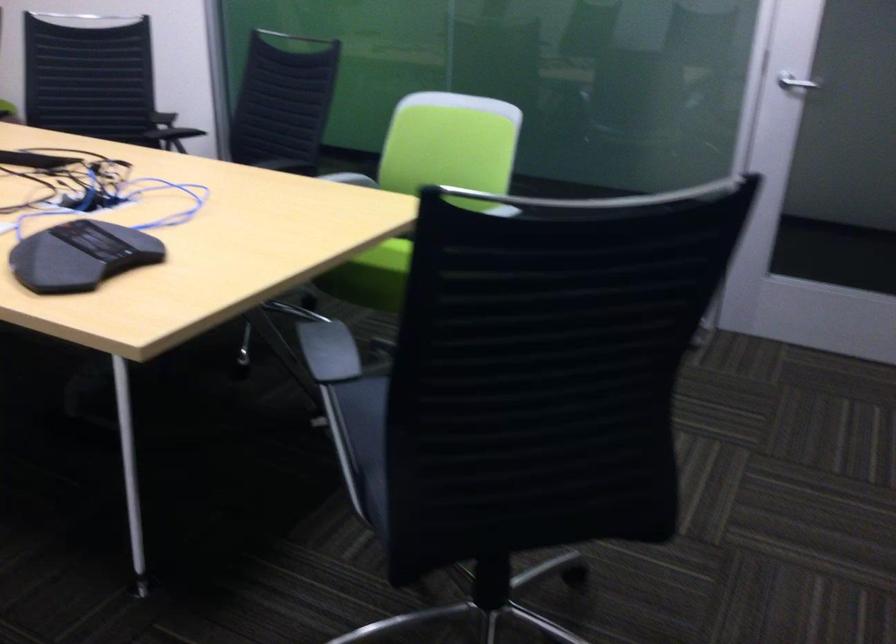
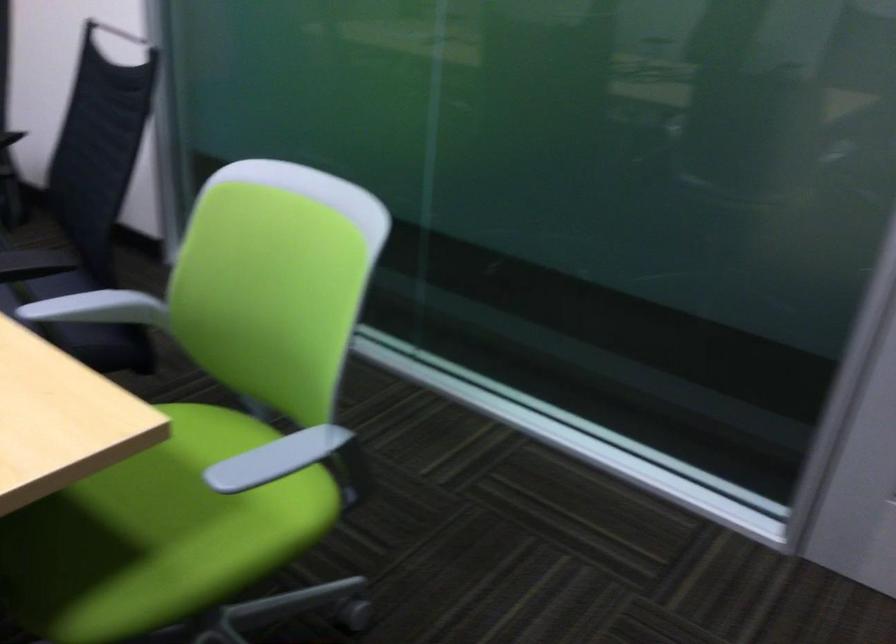
Which direction would the cameraman need to move to produce the second image?

The cameraman walked toward right, forward.